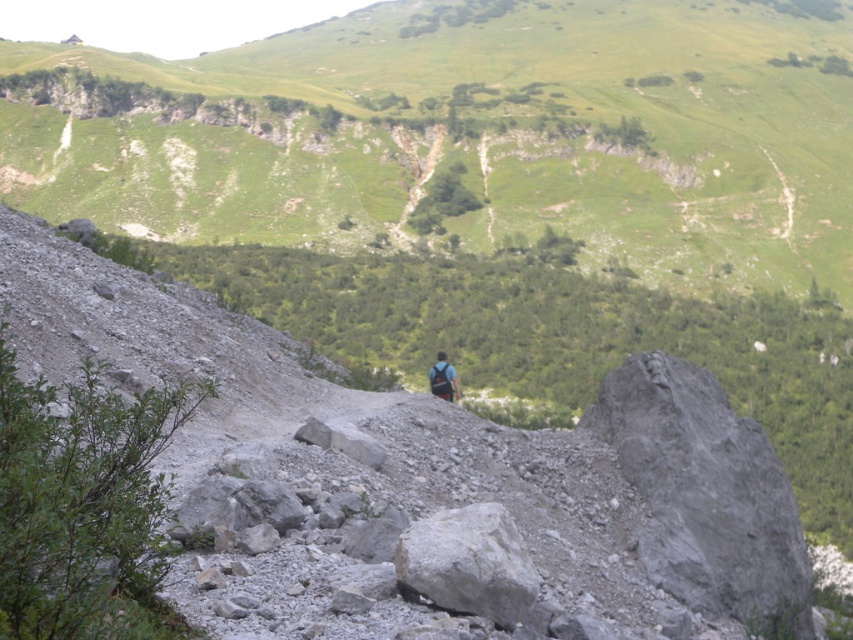
Can you confirm if gray rough rock at center is positioned below dark blue backpack at center?

Yes, gray rough rock at center is below dark blue backpack at center.

Which is above, gray rough rock at center or dark blue backpack at center?

dark blue backpack at center is higher up.

Which is in front, point (432, 529) or point (448, 364)?

Point (432, 529) is more forward.

Find the location of `gray rough rock at center`. gray rough rock at center is located at coordinates pos(468,563).